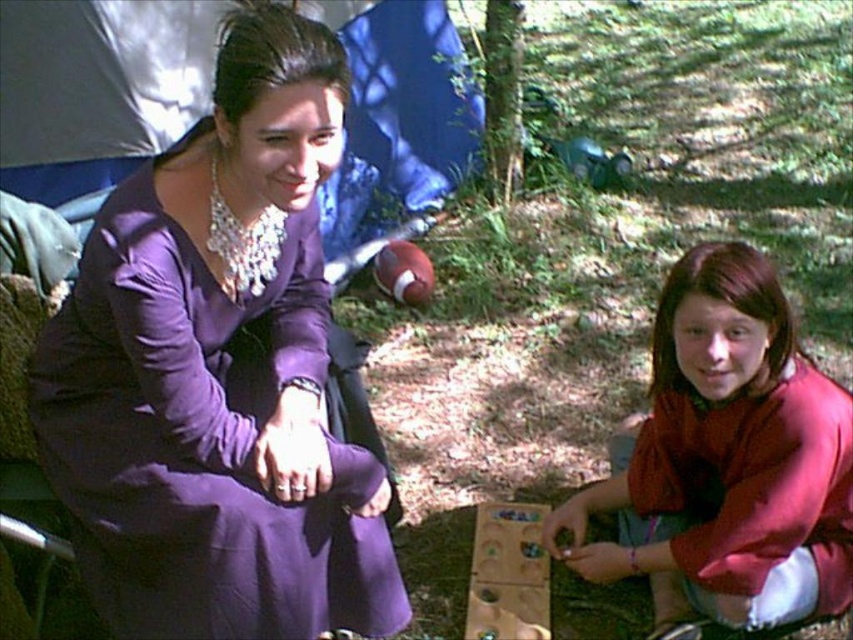
In the scene shown: You are standing at the origin point of the coordinate system. You see a purple satin dress at center marked by point (218,372). If you walk directly towards this point, will you pass by the adult wearing the purple long sleeved top and statement necklace first?

The purple satin dress at center marked by point (218,372) is located at the center of the image. The adult wearing the purple long sleeved top and statement necklace is on the left side of the image. Walking directly towards the point would mean moving towards the center, so you would not pass by the adult on the left first. You would reach the purple satin dress at center first.

In the scene shown: You are a photographer setting up a shoot in a campsite. You have two subjects wearing the purple satin dress at center and the matte red sweater at lower right. To ensure both are visible in the frame, which subject should you position closer to the camera?

The purple satin dress at center should be positioned closer to the camera since it is already in front of the matte red sweater at lower right, ensuring both remain visible.